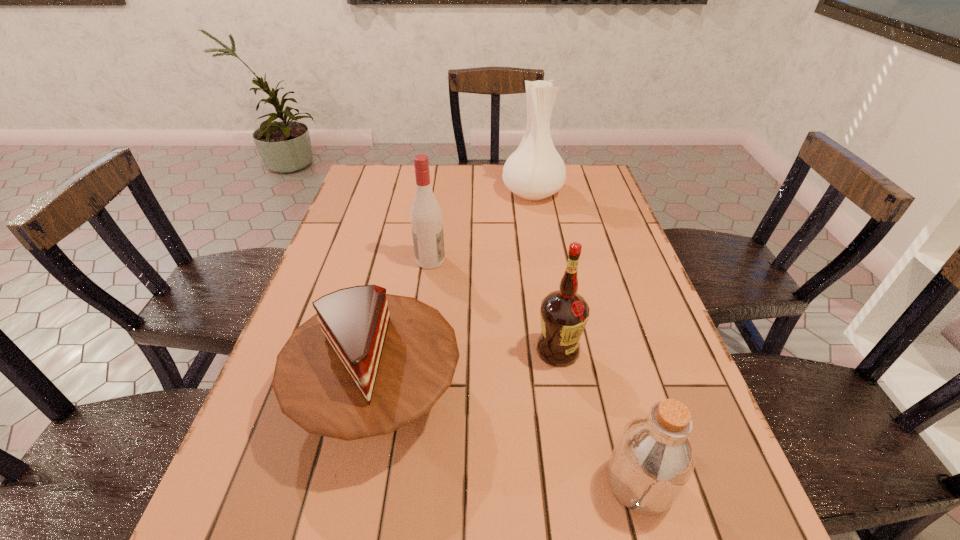
At what (x,y) coordinates should I click in order to perform the action: click on vase. Please return your answer as a coordinate pair (x, y). The height and width of the screenshot is (540, 960). Looking at the image, I should click on (535, 171).

I want to click on the second farthest object, so tap(426, 219).

Locate an element on the screen. This screenshot has height=540, width=960. the farther alcohol is located at coordinates (426, 219).

Find the location of a particular element. The width and height of the screenshot is (960, 540). the right alcohol is located at coordinates (564, 313).

Locate an element on the screen. cake is located at coordinates (367, 363).

Locate an element on the screen. This screenshot has height=540, width=960. bottle is located at coordinates (653, 459).

You are a GUI agent. You are given a task and a screenshot of the screen. Output one action in this format:
    pyautogui.click(x=<x>, y=<y>)
    Task: Click on the free space located on the left of the farthest object
    The width and height of the screenshot is (960, 540).
    Given the screenshot: What is the action you would take?
    pyautogui.click(x=408, y=192)

Locate an element on the screen. The image size is (960, 540). vacant space located 0.210m on the label of the second farthest object is located at coordinates (523, 260).

Where is `free location located on the label of the nearer alcohol`? free location located on the label of the nearer alcohol is located at coordinates (565, 393).

Locate an element on the screen. free spot located 0.270m on the right of the cake is located at coordinates (598, 396).